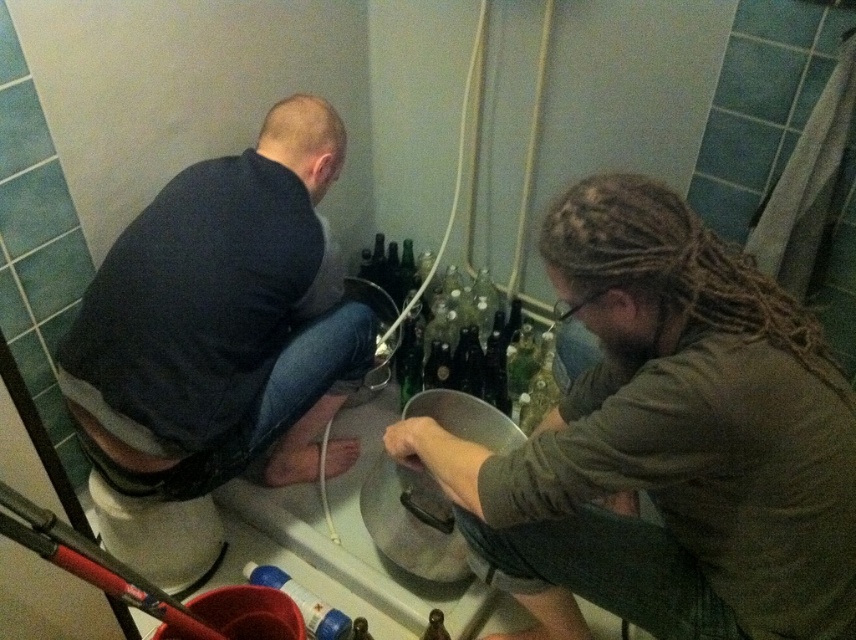
Does dark gray shirt at left have a greater width compared to blue plastic bottle at lower center?

Indeed, dark gray shirt at left has a greater width compared to blue plastic bottle at lower center.

Which of these two, dark gray shirt at left or blue plastic bottle at lower center, stands shorter?

blue plastic bottle at lower center

Who is more forward, (330, 349) or (302, 605)?

Point (302, 605) is in front.

The width and height of the screenshot is (856, 640). What are the coordinates of `dark gray shirt at left` in the screenshot? It's located at (221, 321).